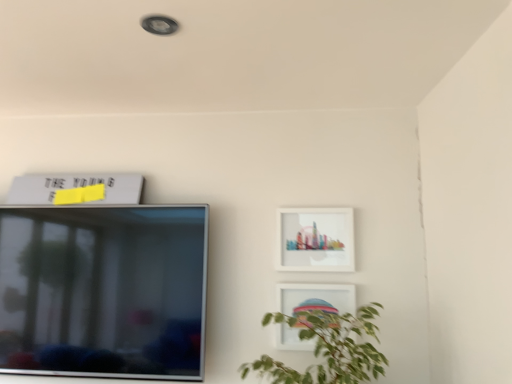
Question: Considering the positions of point (325, 221) and point (17, 193), is point (325, 221) closer or farther from the camera than point (17, 193)?

Choices:
 (A) closer
 (B) farther

Answer: (A)

Question: From the image's perspective, is matte white picture frame at upper right, which is the first picture frame in right-to-left order, positioned above or below white matte picture frame at upper left, the 3th picture frame from the bottom?

Choices:
 (A) above
 (B) below

Answer: (B)

Question: Estimate the real-world distances between objects in this image. Which object is farther from the white matte picture frame at upper left, marked as the 3th picture frame in a right-to-left arrangement?

Choices:
 (A) matte white picture frame at upper right, which is the first picture frame in right-to-left order
 (B) white glossy picture frame at lower right, which appears as the second picture frame when viewed from the right

Answer: (B)

Question: Which object is the farthest from the white glossy picture frame at lower right, which appears as the second picture frame when viewed from the right?

Choices:
 (A) white matte picture frame at upper left, marked as the 3th picture frame in a right-to-left arrangement
 (B) matte white picture frame at upper right, acting as the 3th picture frame starting from the left

Answer: (A)